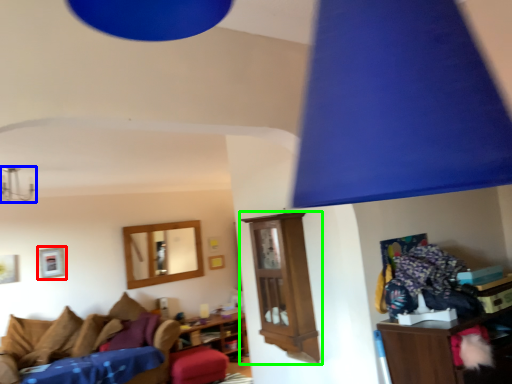
Question: Considering the real-world distances, which object is farthest from picture frame (highlighted by a red box)? lamp (highlighted by a blue box) or shelf (highlighted by a green box)?

Choices:
 (A) lamp
 (B) shelf

Answer: (B)